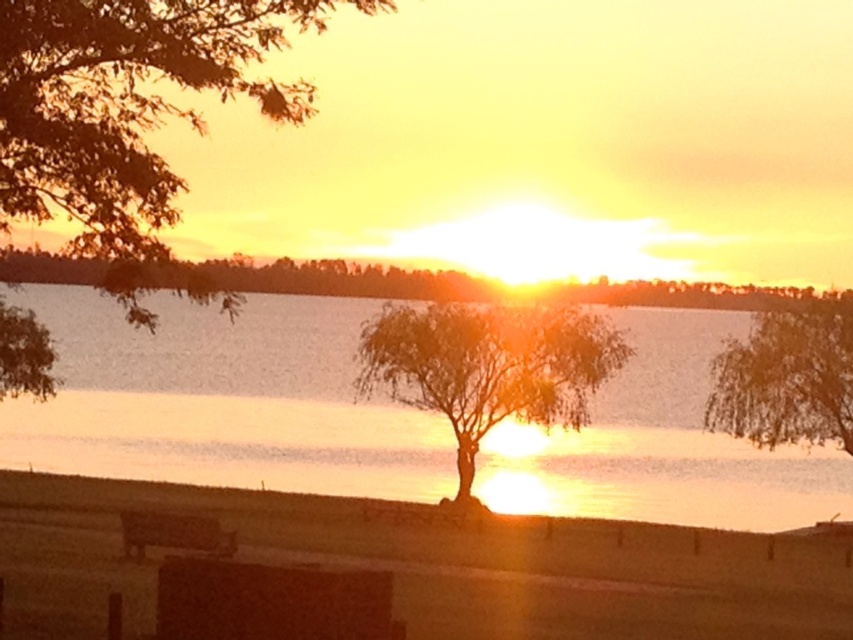
Does translucent glass water at center have a greater height compared to brown textured tree at center?

Yes, translucent glass water at center is taller than brown textured tree at center.

In the scene shown: Is translucent glass water at center wider than brown textured tree at center?

Correct, the width of translucent glass water at center exceeds that of brown textured tree at center.

Between point (242, 404) and point (776, 323), which one is positioned in front?

Point (776, 323)

Identify the location of translucent glass water at center. (222, 401).

Measure the distance between green leafy tree at center and brown textured tree at center.

A distance of 18.68 feet exists between green leafy tree at center and brown textured tree at center.

Between green leafy tree at center and brown textured tree at center, which one has less height?

green leafy tree at center

Describe the element at coordinates (488, 368) in the screenshot. I see `green leafy tree at center` at that location.

This screenshot has height=640, width=853. What are the coordinates of `green leafy tree at center` in the screenshot? It's located at (488, 368).

Is brown textured tree at center to the right of wooden park bench at lower left from the viewer's perspective?

Correct, you'll find brown textured tree at center to the right of wooden park bench at lower left.

Who is more distant from viewer, (x=836, y=404) or (x=213, y=538)?

Point (x=836, y=404)

Does point (810, 422) come closer to viewer compared to point (196, 536)?

That is False.

Locate an element on the screen. brown textured tree at center is located at coordinates (787, 376).